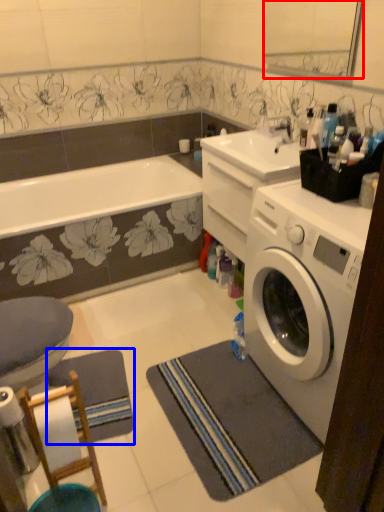
Question: Which object appears closest to the camera in this image, mirror (highlighted by a red box) or yoga mat (highlighted by a blue box)?

Choices:
 (A) mirror
 (B) yoga mat

Answer: (B)